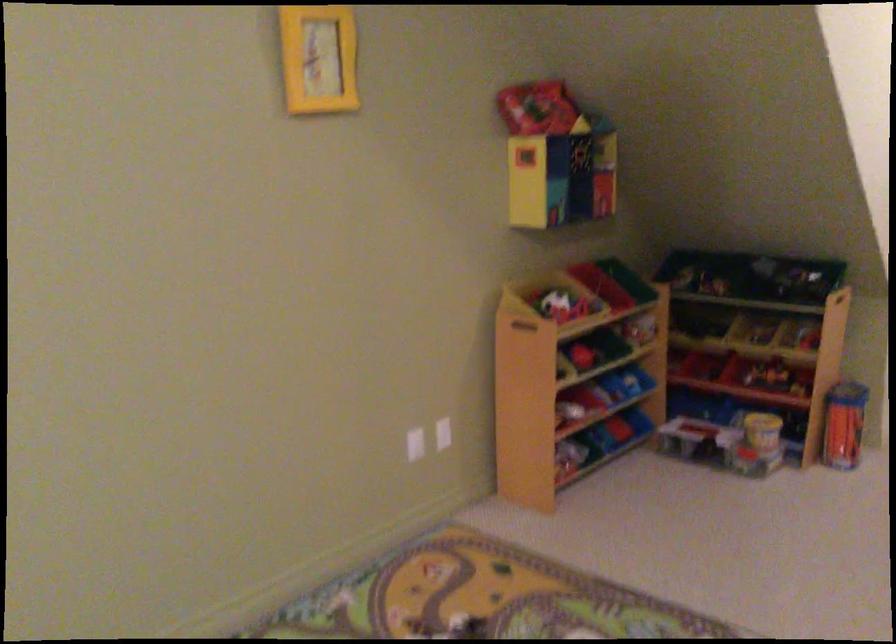
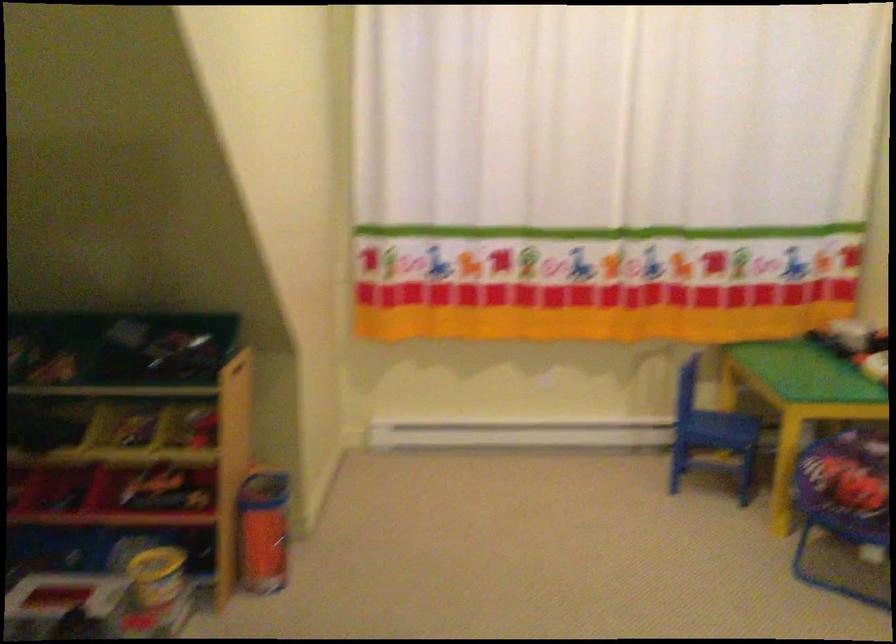
The point at (x=764, y=348) is marked in the first image. Where is the corresponding point in the second image?

(145, 457)